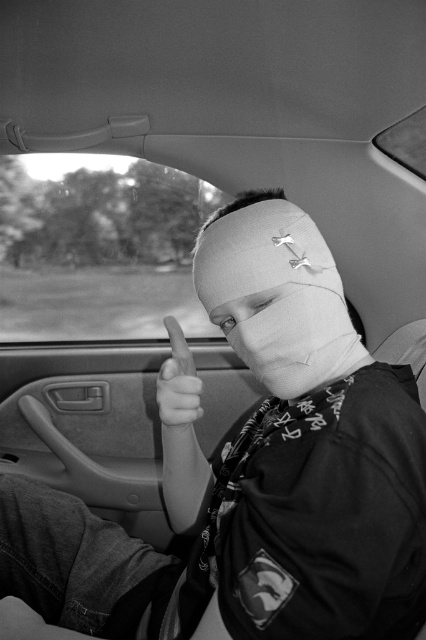
Question: Which is nearer to the transparent glass car window at upper center?

Choices:
 (A) white matte bandage at center
 (B) smooth white bandage at center

Answer: (A)

Question: Is white matte bandage at center below smooth white bandage at center?

Choices:
 (A) yes
 (B) no

Answer: (A)

Question: Which point is farther from the camera taking this photo?

Choices:
 (A) (187, 348)
 (B) (241, 220)

Answer: (A)

Question: Does white bandage at center appear on the left side of smooth white bandage at center?

Choices:
 (A) yes
 (B) no

Answer: (B)

Question: Estimate the real-world distances between objects in this image. Which object is closer to the transparent glass car window at upper center?

Choices:
 (A) white bandage at center
 (B) white matte bandage at center

Answer: (A)

Question: Can you confirm if white bandage at center is positioned to the right of smooth white bandage at center?

Choices:
 (A) yes
 (B) no

Answer: (A)